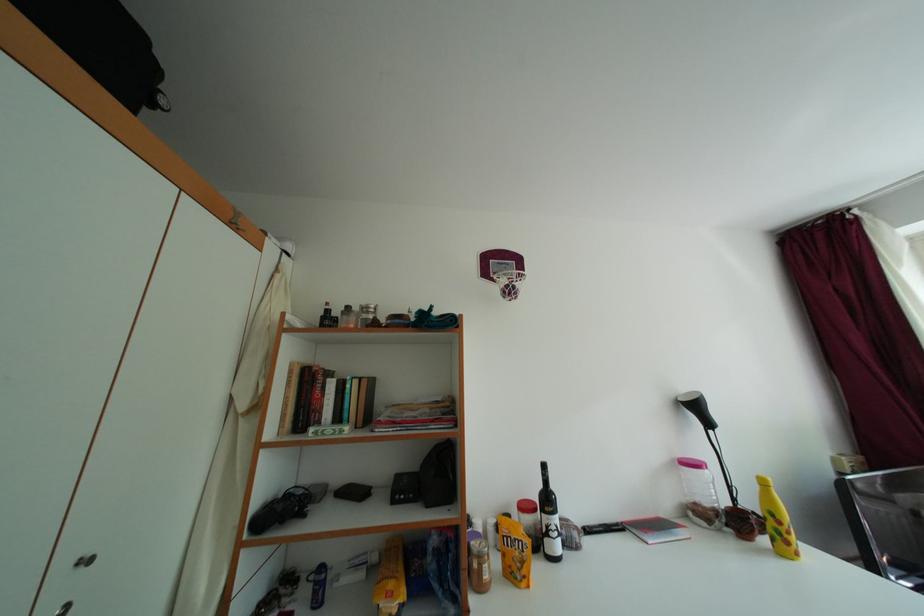
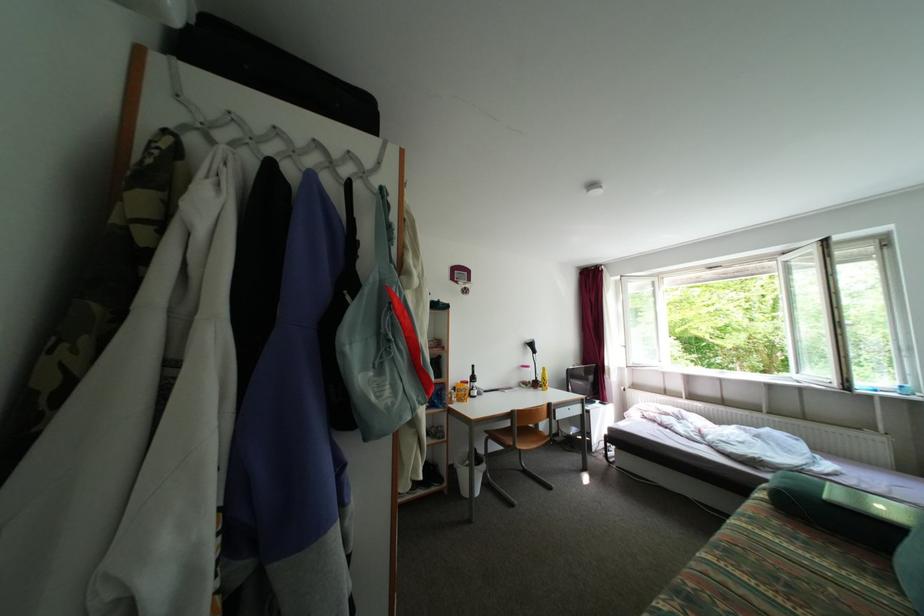
Looking at this image, what movement of the cameraman would produce the second image?

The cameraman moved toward left, backward.